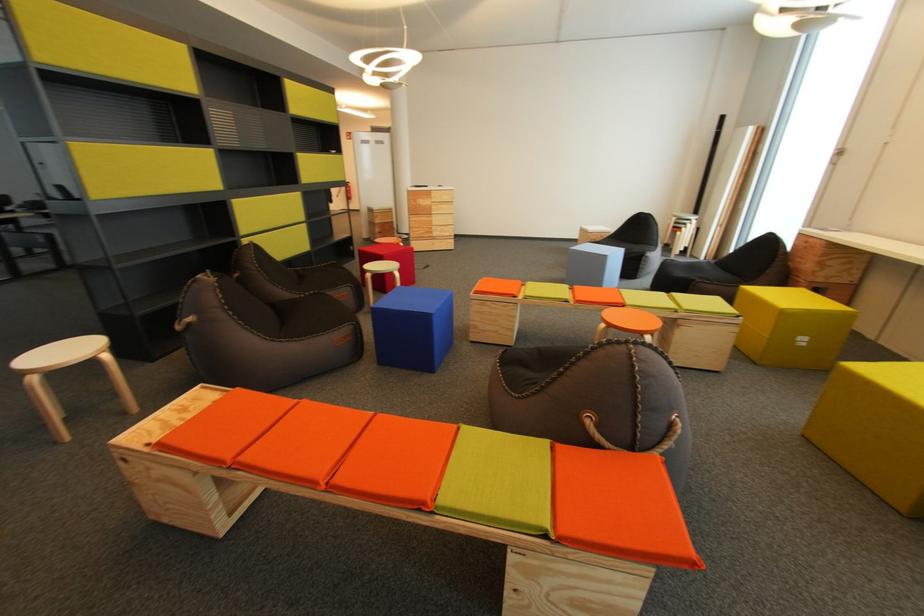
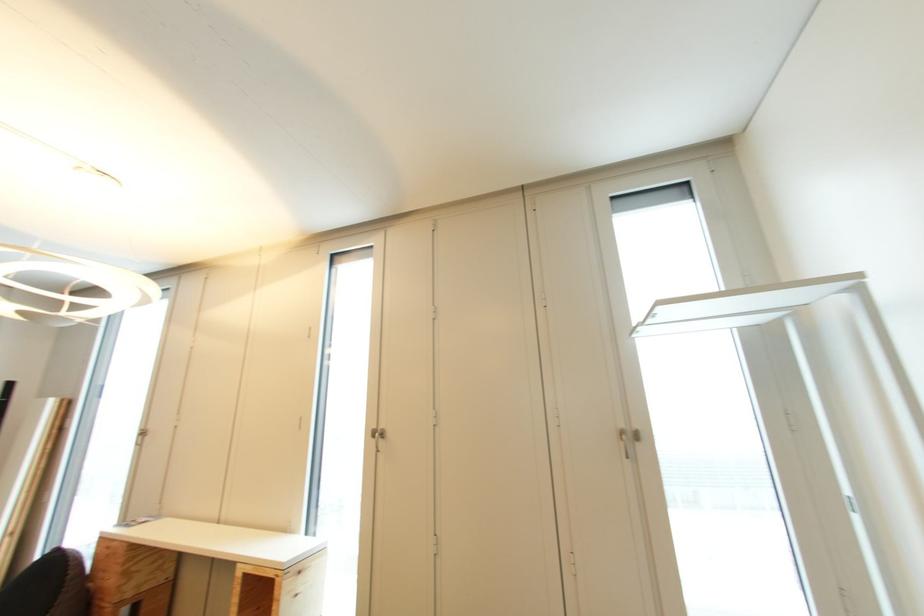
Based on the continuous images, in which direction is the camera rotating?

The camera rotated toward right-up.